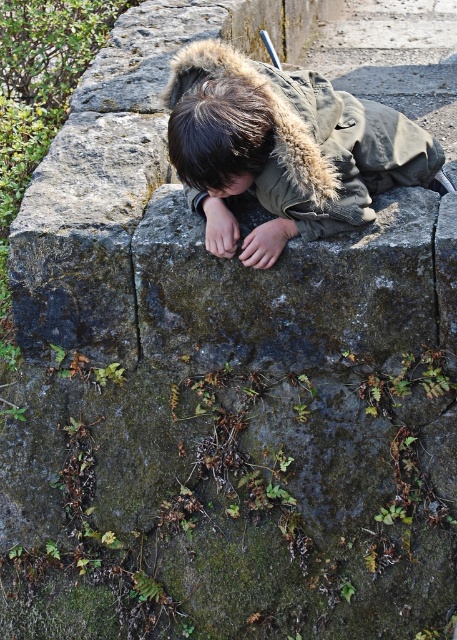
Consider the image. Is khaki fleece-lined jacket at center further to camera compared to dark brown hair at center?

Yes, khaki fleece-lined jacket at center is further from the viewer.

Which of these two, khaki fleece-lined jacket at center or dark brown hair at center, stands taller?

khaki fleece-lined jacket at center

Where is `khaki fleece-lined jacket at center`? khaki fleece-lined jacket at center is located at coordinates (283, 148).

The height and width of the screenshot is (640, 457). Find the location of `khaki fleece-lined jacket at center`. khaki fleece-lined jacket at center is located at coordinates (283, 148).

Which is above, khaki fleece-lined jacket at center or brown matte hair at center?

Positioned higher is khaki fleece-lined jacket at center.

At what (x,y) coordinates should I click in order to perform the action: click on khaki fleece-lined jacket at center. Please return your answer as a coordinate pair (x, y). Looking at the image, I should click on (283, 148).

Is point (211, 122) in front of point (238, 192)?

Yes.

Image resolution: width=457 pixels, height=640 pixels. Find the location of `khaki fleece-lined jacket at center`. khaki fleece-lined jacket at center is located at coordinates (283, 148).

Between dark brown hair at center and brown matte hair at center, which one has less height?

Standing shorter between the two is brown matte hair at center.

The height and width of the screenshot is (640, 457). Describe the element at coordinates (219, 134) in the screenshot. I see `dark brown hair at center` at that location.

Is point (260, 113) less distant than point (237, 193)?

Yes, point (260, 113) is in front of point (237, 193).

What are the coordinates of `dark brown hair at center` in the screenshot? It's located at (219, 134).